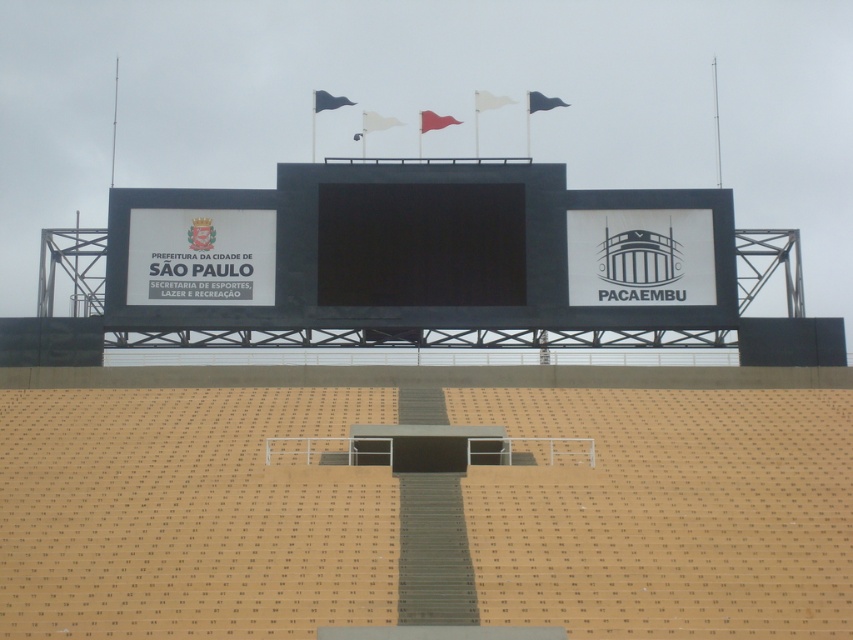
Question: Which point is closer to the camera?

Choices:
 (A) black fabric flag at upper center
 (B) blue fabric flag at upper center
 (C) black matte scoreboard at center
 (D) white fabric flag at upper center

Answer: (C)

Question: Is the position of black matte scoreboard at center more distant than that of white fabric flag at upper center?

Choices:
 (A) yes
 (B) no

Answer: (B)

Question: Can you confirm if red fabric flag at center is bigger than black fabric flag at upper center?

Choices:
 (A) no
 (B) yes

Answer: (A)

Question: Which of the following is the farthest from the observer?

Choices:
 (A) red fabric flag at center
 (B) black fabric flag at upper center
 (C) white fabric flag at upper center

Answer: (C)

Question: Does black matte scoreboard at center appear on the right side of blue fabric flag at upper center?

Choices:
 (A) yes
 (B) no

Answer: (A)

Question: Estimate the real-world distances between objects in this image. Which object is farther from the blue fabric flag at upper center?

Choices:
 (A) white fabric flag at upper center
 (B) black matte scoreboard at center

Answer: (B)